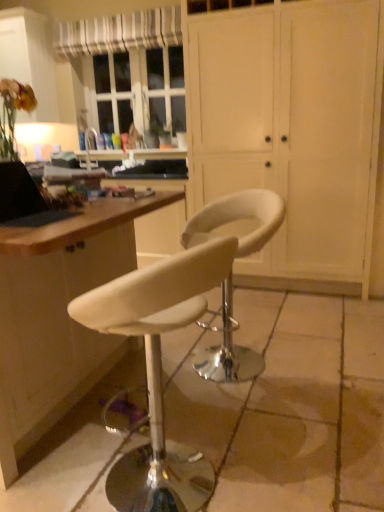
Find the location of a particular element. free point below white leather stool at center, which appears as the 2th chair when viewed from the back (from a real-world perspective) is located at coordinates (194, 482).